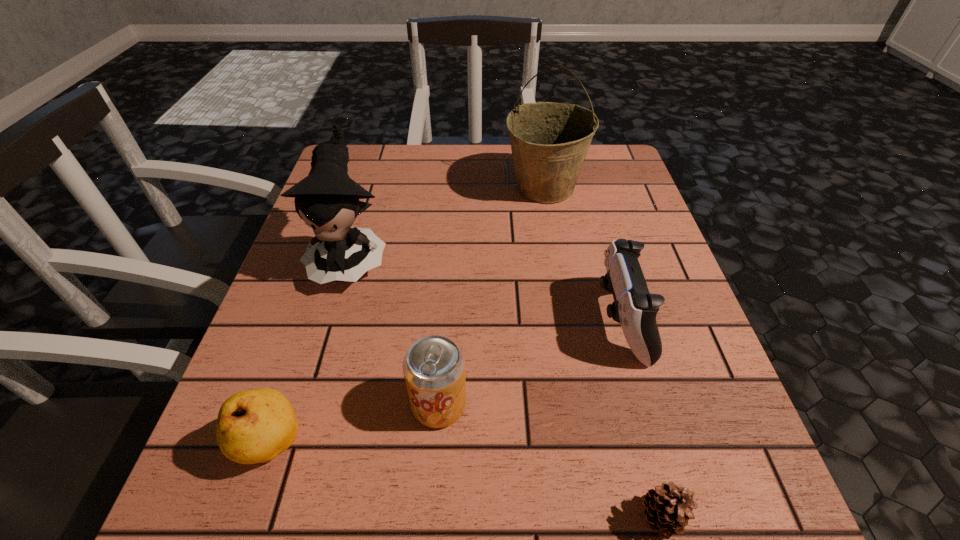
Identify the location of the tallest object. (549, 141).

This screenshot has width=960, height=540. What are the coordinates of `the farthest object` in the screenshot? It's located at (549, 141).

Image resolution: width=960 pixels, height=540 pixels. What are the coordinates of `doll` in the screenshot? It's located at (327, 200).

Locate an element on the screen. The image size is (960, 540). control is located at coordinates (634, 307).

Where is `pop (soda)`? This screenshot has width=960, height=540. pop (soda) is located at coordinates (434, 367).

You are a GUI agent. You are given a task and a screenshot of the screen. Output one action in this format:
    pyautogui.click(x=<x>, y=<y>)
    Task: Click on the pear
    
    Given the screenshot: What is the action you would take?
    pyautogui.click(x=254, y=426)

Identify the location of free region located 0.260m on the left of the wine bucket. The image size is (960, 540). (399, 187).

Find the location of a particular element. This screenshot has height=540, width=960. vacant area located at the face of the second tallest object is located at coordinates (286, 475).

Find the location of a particular element. The image size is (960, 540). free spot located 0.310m on the front-facing side of the control is located at coordinates 427,321.

Where is `free space located on the front-facing side of the control`? The width and height of the screenshot is (960, 540). free space located on the front-facing side of the control is located at coordinates (384, 321).